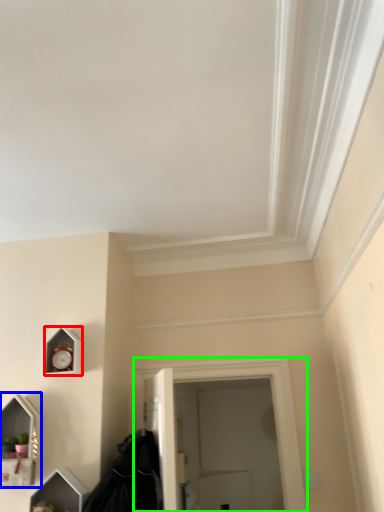
Question: Estimate the real-world distances between objects in this image. Which object is closer to clock (highlighted by a red box), medicine cabinet (highlighted by a blue box) or window (highlighted by a green box)?

Choices:
 (A) medicine cabinet
 (B) window

Answer: (A)